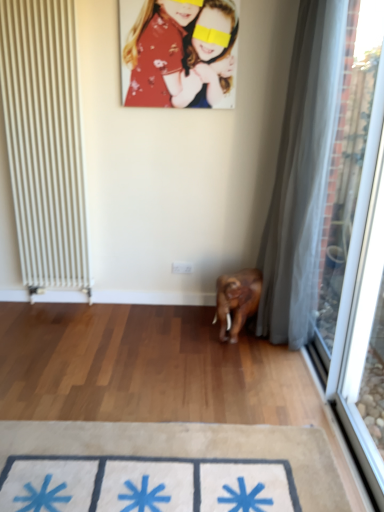
Question: Is white sheer curtain at right wider or thinner than white metal radiator at left?

Choices:
 (A) thin
 (B) wide

Answer: (B)

Question: Is white sheer curtain at right situated inside white metal radiator at left or outside?

Choices:
 (A) inside
 (B) outside

Answer: (B)

Question: Which is farther from the white sheer curtain at right?

Choices:
 (A) floral fabric portrait at upper center
 (B) white metal radiator at left
 (C) beige fabric doormat at lower center
 (D) transparent fabric at right

Answer: (B)

Question: Which is farther from the white metal radiator at left?

Choices:
 (A) transparent fabric at right
 (B) white sheer curtain at right
 (C) beige fabric doormat at lower center
 (D) floral fabric portrait at upper center

Answer: (A)